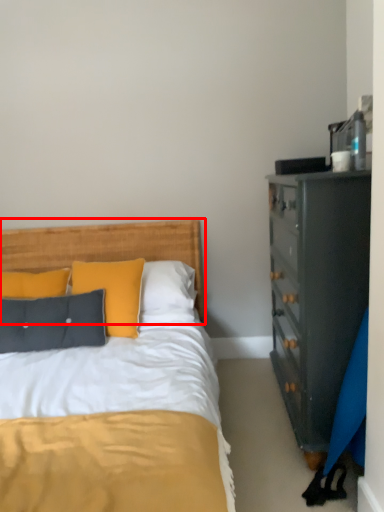
Question: From the image's perspective, where is headboard (annotated by the red box) located relative to pillow?

Choices:
 (A) below
 (B) above

Answer: (B)